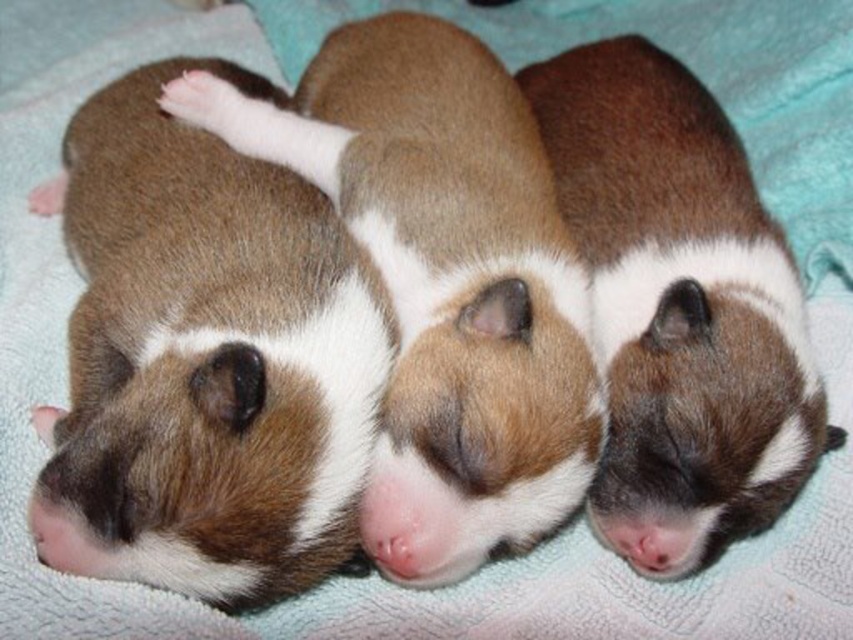
Question: Can you confirm if brown fur puppy at left is positioned to the right of brown fuzzy guinea pig at center?

Choices:
 (A) no
 (B) yes

Answer: (A)

Question: Which object appears closest to the camera in this image?

Choices:
 (A) brown fuzzy guinea pig at center
 (B) brown fur puppy at left

Answer: (B)

Question: Which of the following is the closest to the observer?

Choices:
 (A) (292, 195)
 (B) (448, 518)
 (C) (695, 115)

Answer: (B)

Question: Does brown fur puppy at left lie in front of brown soft fur puppy at center?

Choices:
 (A) no
 (B) yes

Answer: (B)

Question: Where is brown fur puppy at left located in relation to brown soft fur puppy at center in the image?

Choices:
 (A) below
 (B) above

Answer: (A)

Question: Estimate the real-world distances between objects in this image. Which object is farther from the brown fur puppy at left?

Choices:
 (A) brown fuzzy guinea pig at center
 (B) brown soft fur puppy at center

Answer: (A)